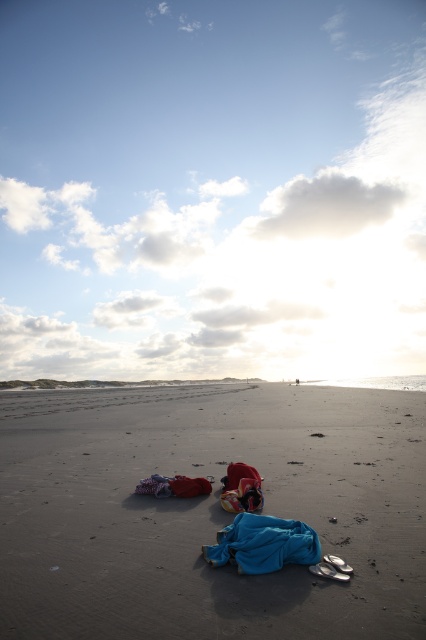
You are a beachgoer who wants to spread out a picnic blanket. You see the blue fabric at center and the blue cotton blanket at center. Which one should you choose if you want the larger one for more space?

The blue fabric at center is bigger than the blue cotton blanket at center, so you should choose the blue fabric at center for more space.

You are standing on the beach and see two points marked on the sand. The first point is at coordinates point (x=255, y=628) and the second is at point (x=290, y=538). Which point is nearer to you?

Point (x=255, y=628) is closer to the viewer than point (x=290, y=538).

You are a drone operator trying to capture a closeup of the smooth sand at center. The drone is currently at point 0.800, 0.491. Where should you direct the drone to get the best shot?

The smooth sand at center is located at point [209,512], so directing the drone to that exact coordinate will provide the best closeup shot.